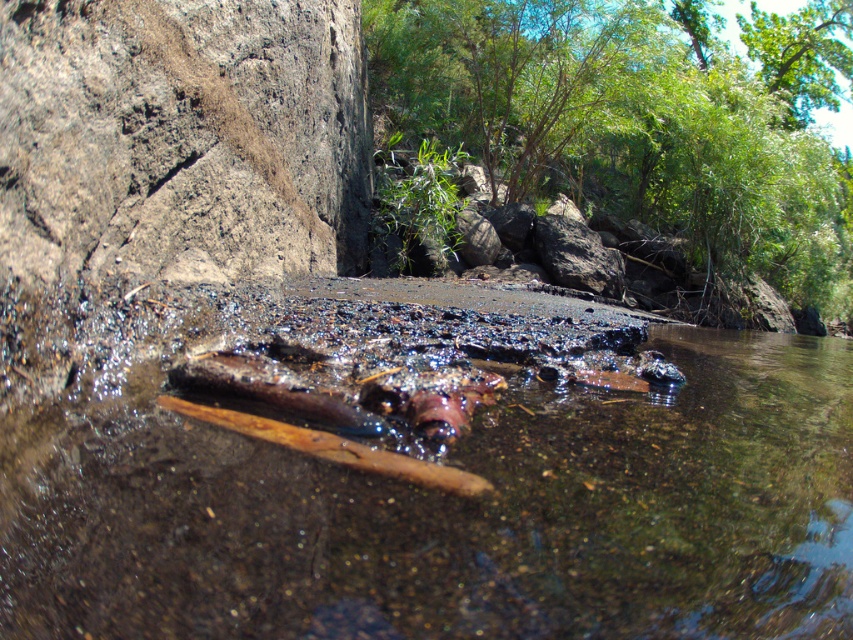
You are a photographer standing at the edge of the water body. You want to take a photo that includes both the brown wood at center and the rough textured rock at left. Which object should you focus on first to ensure both are in clear view?

You should focus on the brown wood at center first since it is closer to you than the rough textured rock at left, ensuring both objects remain in focus.

You are a hiker who has just found a piece of wood in a stream. You need to determine if it can be used to cross the water safely. The wood is at the center of the image. Based on the scene description, what should you consider about the brown wood at center?

The brown wood at center is partially submerged in water, so it may not provide stable footing for crossing. Check if it is securely anchored or large enough to support your weight before attempting to step on it.

You are a photographer trying to capture the brown wood at center and the rough textured rock at left in the same frame. Based on their sizes, which object would appear smaller in the photo?

The brown wood at center appears smaller in the photo because it is not as tall as the rough textured rock at left.